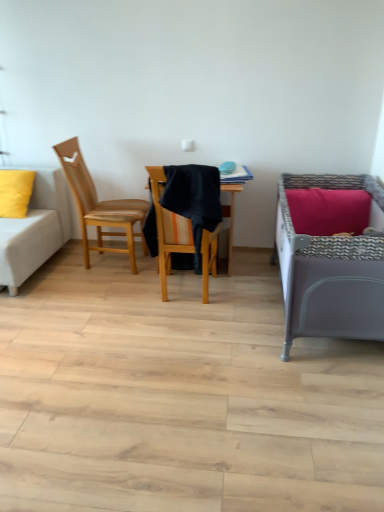
Where is `free space in front of gray fabric infant bed at right`? free space in front of gray fabric infant bed at right is located at coordinates (296, 412).